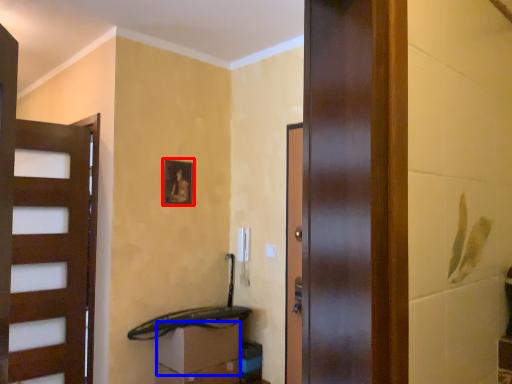
Question: Which point is further to the camera, picture frame (highlighted by a red box) or drawer (highlighted by a blue box)?

Choices:
 (A) picture frame
 (B) drawer

Answer: (A)